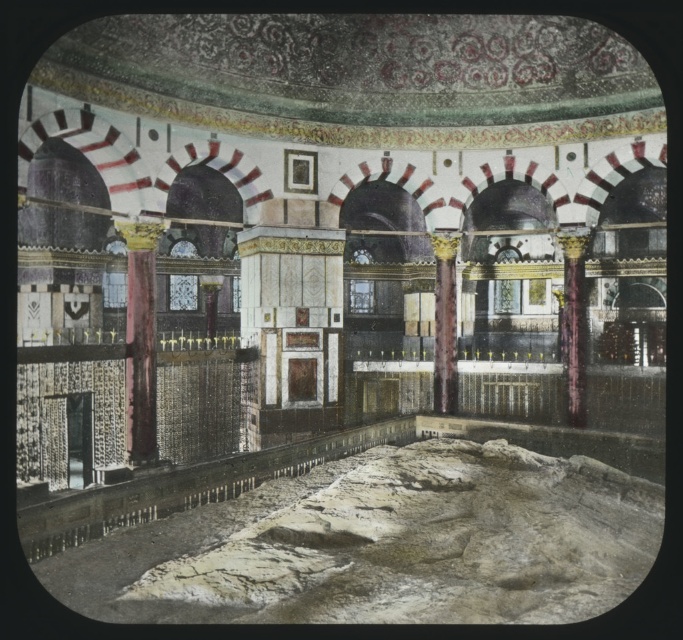
Question: Is the position of marble column at center less distant than that of maroon polished column at center?

Choices:
 (A) no
 (B) yes

Answer: (B)

Question: Which of the following is the closest to the observer?

Choices:
 (A) (436, 346)
 (B) (566, 308)

Answer: (A)

Question: Among these points, which one is nearest to the camera?

Choices:
 (A) (446, 301)
 (B) (570, 253)

Answer: (B)

Question: Is marble column at center further to camera compared to maroon polished column at center?

Choices:
 (A) yes
 (B) no

Answer: (B)

Question: Which of the following is the closest to the observer?

Choices:
 (A) marble column at center
 (B) maroon polished column at center

Answer: (A)

Question: Is marble column at center smaller than maroon polished column at center?

Choices:
 (A) no
 (B) yes

Answer: (A)